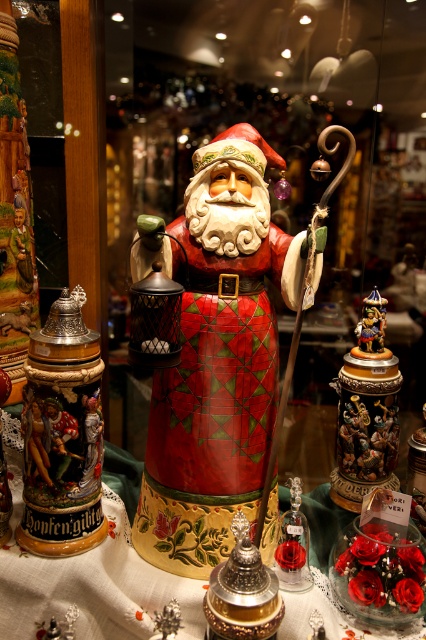
Question: Observing the image, what is the correct spatial positioning of matte glass vase at center in reference to shiny silver ornament at center?

Choices:
 (A) above
 (B) below

Answer: (B)

Question: Estimate the real-world distances between objects in this image. Which object is closer to the matte ceramic santa at center?

Choices:
 (A) matte glass vase at center
 (B) gold metallic stein at left
 (C) matte glass ornament at center

Answer: (B)

Question: Which point is closer to the camera?

Choices:
 (A) matte ceramic santa at center
 (B) gold metallic carousel at right
 (C) matte glass vase at center
 (D) matte glass ornament at center

Answer: (C)

Question: Where is gold metallic stein at left located in relation to gold metallic carousel at right in the image?

Choices:
 (A) right
 (B) left

Answer: (B)

Question: Can you confirm if matte ceramic santa at center is smaller than shiny silver ornament at center?

Choices:
 (A) no
 (B) yes

Answer: (A)

Question: Which of the following is the farthest from the observer?

Choices:
 (A) (276, 579)
 (B) (291, 237)

Answer: (B)